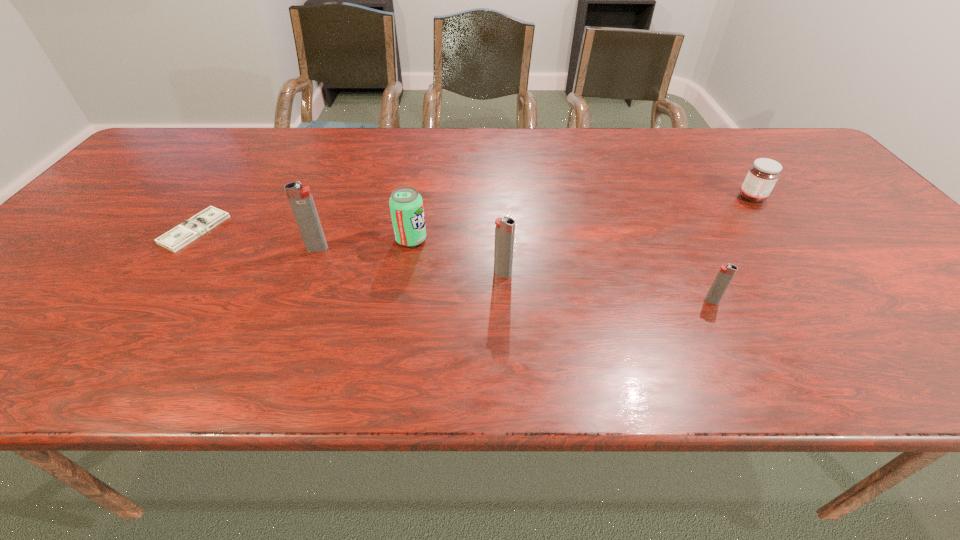
Find the location of a particular element. the leftmost igniter is located at coordinates (301, 201).

I want to click on the farthest igniter, so click(x=301, y=201).

Locate an element on the screen. This screenshot has height=540, width=960. the second tallest igniter is located at coordinates (504, 228).

Find the location of a particular element. The height and width of the screenshot is (540, 960). the second nearest object is located at coordinates (504, 228).

At what (x,y) coordinates should I click in order to perform the action: click on the rightmost igniter. Please return your answer as a coordinate pair (x, y). This screenshot has height=540, width=960. Looking at the image, I should click on (725, 274).

Locate an element on the screen. the nearest object is located at coordinates (725, 274).

Where is `the farthest object`? the farthest object is located at coordinates (762, 176).

You are a GUI agent. You are given a task and a screenshot of the screen. Output one action in this format:
    pyautogui.click(x=<x>, y=<y>)
    Task: Click on the jam
    Image resolution: width=960 pixels, height=540 pixels.
    Given the screenshot: What is the action you would take?
    pyautogui.click(x=762, y=176)

Identify the location of the shortest object. (178, 237).

Where is `dollar`? The width and height of the screenshot is (960, 540). dollar is located at coordinates coord(178,237).